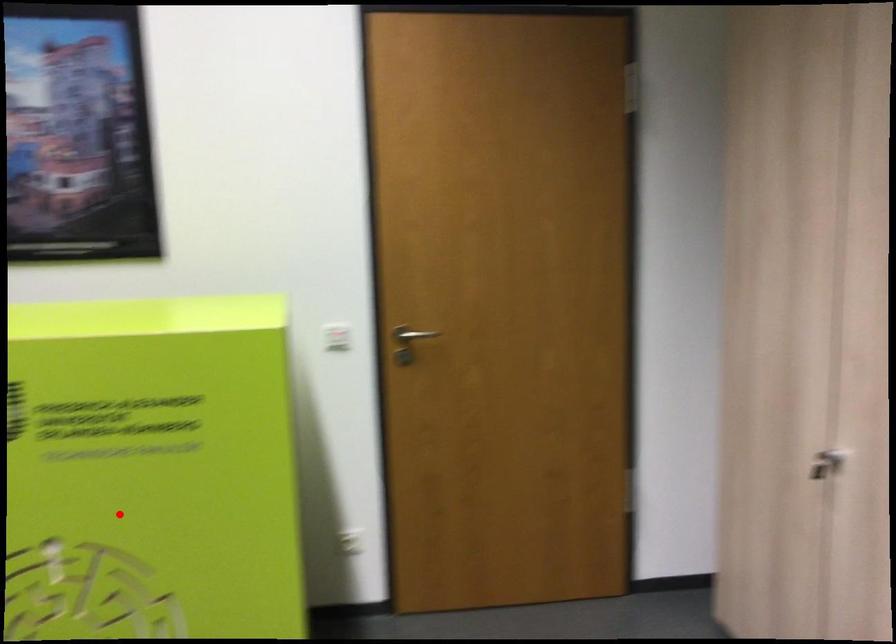
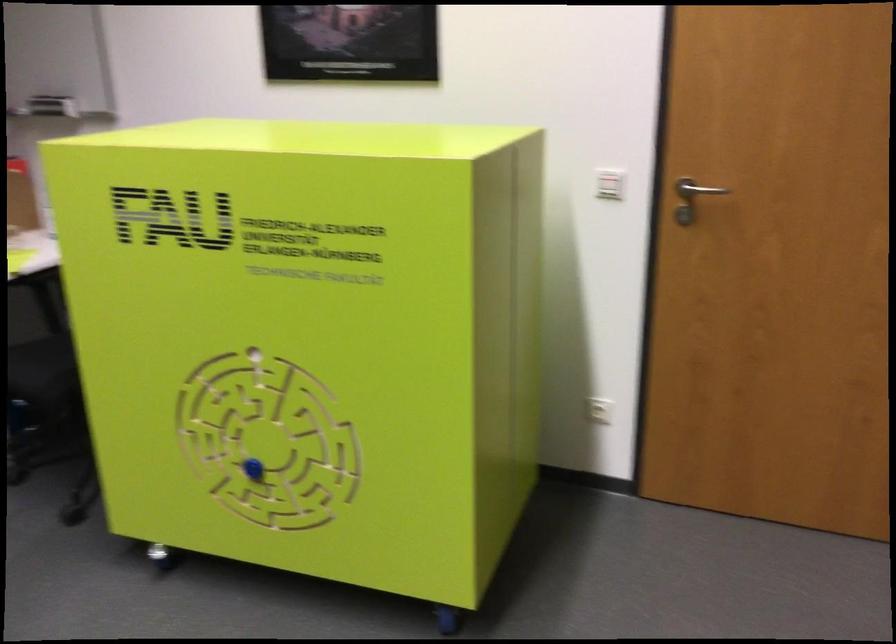
Find the pixel in the second image that matches the highlighted location in the first image.

(309, 341)